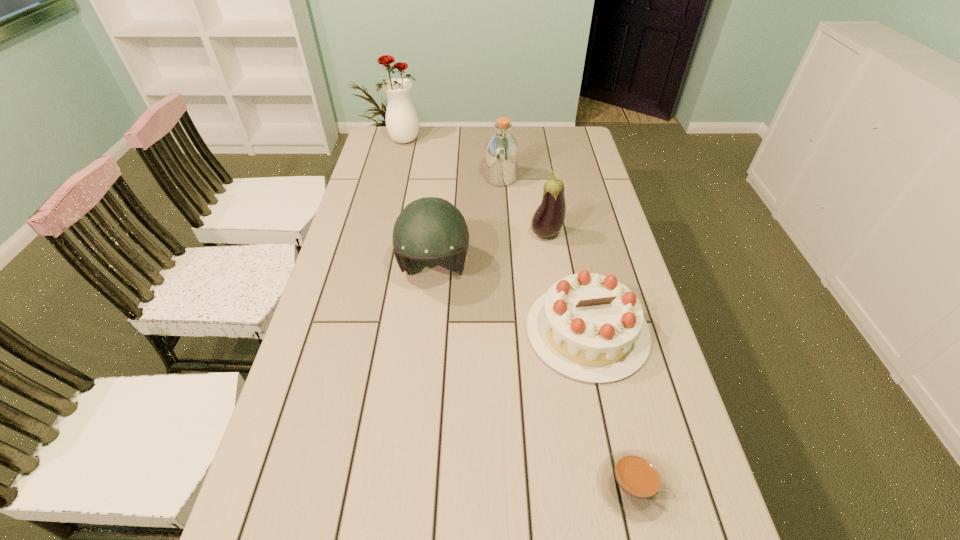
Image resolution: width=960 pixels, height=540 pixels. Identify the location of empty space between the tallest object and the fifth nearest object. (452, 160).

Identify the location of vacant space that's between the tallest object and the cappuccino. (517, 313).

Locate an element on the screen. object that is the closest one to the vase is located at coordinates (502, 151).

Select which object is the second closest to the football helmet. Please provide its 2D coordinates. Your answer should be formatted as a tuple, i.e. [(x, y)], where the tuple contains the x and y coordinates of a point satisfying the conditions above.

[(549, 217)]

The width and height of the screenshot is (960, 540). What are the coordinates of `free location that satisfies the following two spatial constraints: 1. on the front side of the eggplant; 2. on the left side of the fifth tallest object` in the screenshot? It's located at (562, 331).

Locate an element on the screen. vacant area in the image that satisfies the following two spatial constraints: 1. on the front side of the birthday cake; 2. on the right side of the tallest object is located at coordinates (359, 331).

In order to click on vacant space that satisfies the following two spatial constraints: 1. on the front side of the birthday cake; 2. on the left side of the nearest object in this screenshot , I will do `click(619, 486)`.

I want to click on free point that satisfies the following two spatial constraints: 1. on the front side of the farthest object; 2. on the left side of the bottle, so click(395, 179).